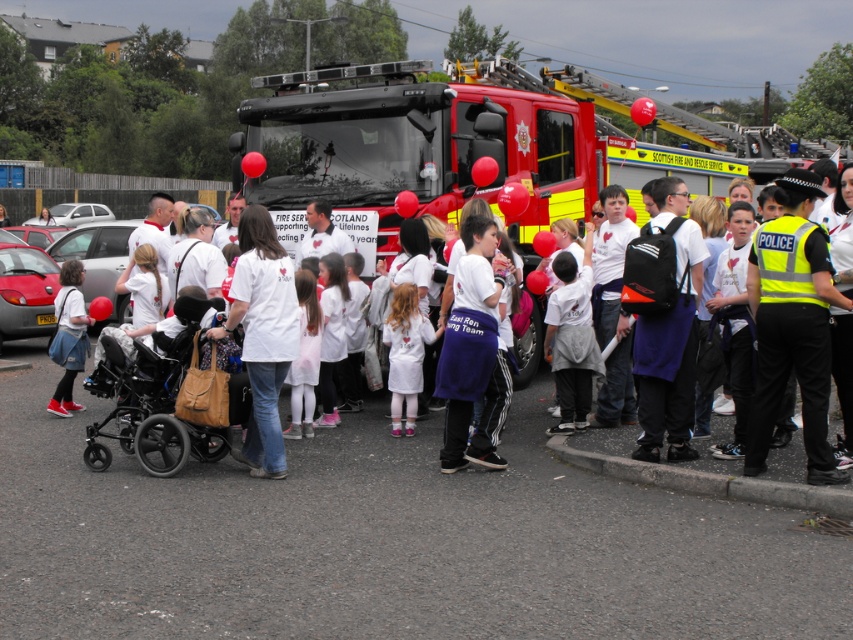
Question: Is the position of black fabric baby carriage at center-left less distant than that of white cotton dress at center?

Choices:
 (A) yes
 (B) no

Answer: (A)

Question: Where is red/yellow fire truck at center located in relation to white cotton dress at center in the image?

Choices:
 (A) right
 (B) left

Answer: (A)

Question: Can you confirm if white cotton t-shirt at center is positioned above white cotton shirt at center?

Choices:
 (A) no
 (B) yes

Answer: (A)

Question: Which object is the closest to the red/yellow fire truck at center?

Choices:
 (A) white cotton shirt at center
 (B) white cotton dress at center

Answer: (A)

Question: Estimate the real-world distances between objects in this image. Which object is farther from the black fabric baby carriage at center-left?

Choices:
 (A) red/yellow fire truck at center
 (B) white cotton shirt at center

Answer: (A)

Question: Which point is closer to the camera taking this photo?

Choices:
 (A) (589, 124)
 (B) (485, 260)

Answer: (B)